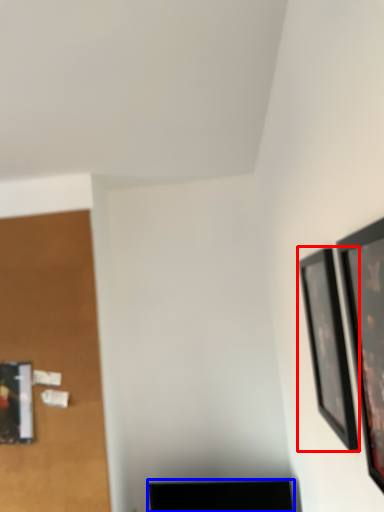
Question: Among these objects, which one is farthest to the camera, picture frame (highlighted by a red box) or furniture (highlighted by a blue box)?

Choices:
 (A) picture frame
 (B) furniture

Answer: (B)